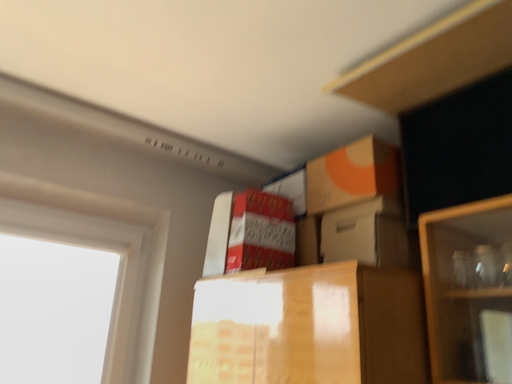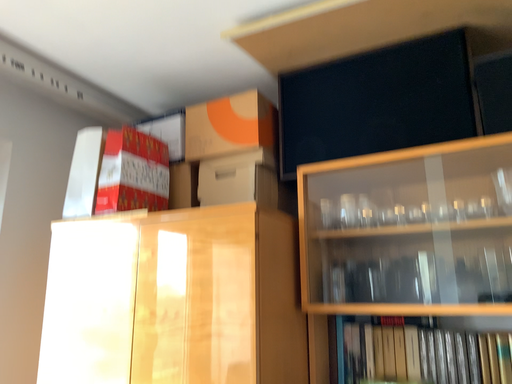
Question: How did the camera likely rotate when shooting the video?

Choices:
 (A) rotated right
 (B) rotated left

Answer: (A)